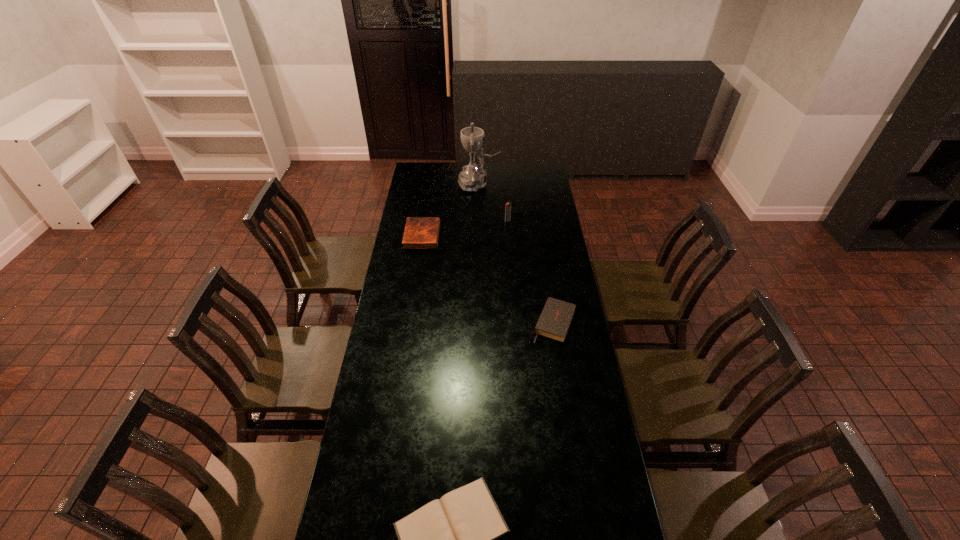
Where is `vacant region located 0.140m on the spine side of the third nearest object`? vacant region located 0.140m on the spine side of the third nearest object is located at coordinates (467, 235).

Find the location of a particular element. object at the far edge is located at coordinates (473, 177).

This screenshot has height=540, width=960. In order to click on object located at the left edge in this screenshot , I will do `click(420, 232)`.

What are the coordinates of `object that is positioned at the right edge` in the screenshot? It's located at (555, 319).

In the image, there is a desktop. Where is `vacant space at the left edge`? Image resolution: width=960 pixels, height=540 pixels. vacant space at the left edge is located at coordinates (416, 200).

Where is `blank space at the right edge of the desktop`? blank space at the right edge of the desktop is located at coordinates (570, 329).

At what (x,y) coordinates should I click in order to perform the action: click on vacant space at the far left corner of the desktop. Please return your answer as a coordinate pair (x, y). The width and height of the screenshot is (960, 540). Looking at the image, I should click on (431, 164).

The height and width of the screenshot is (540, 960). In the image, there is a desktop. In order to click on free space at the far right corner in this screenshot , I will do `click(549, 171)`.

Locate an element on the screen. The width and height of the screenshot is (960, 540). vacant region between the fourth nearest object and the award is located at coordinates (493, 202).

At what (x,y) coordinates should I click in order to perform the action: click on unoccupied area between the fourth nearest object and the farthest object. Please return your answer as a coordinate pair (x, y). Looking at the image, I should click on tap(493, 202).